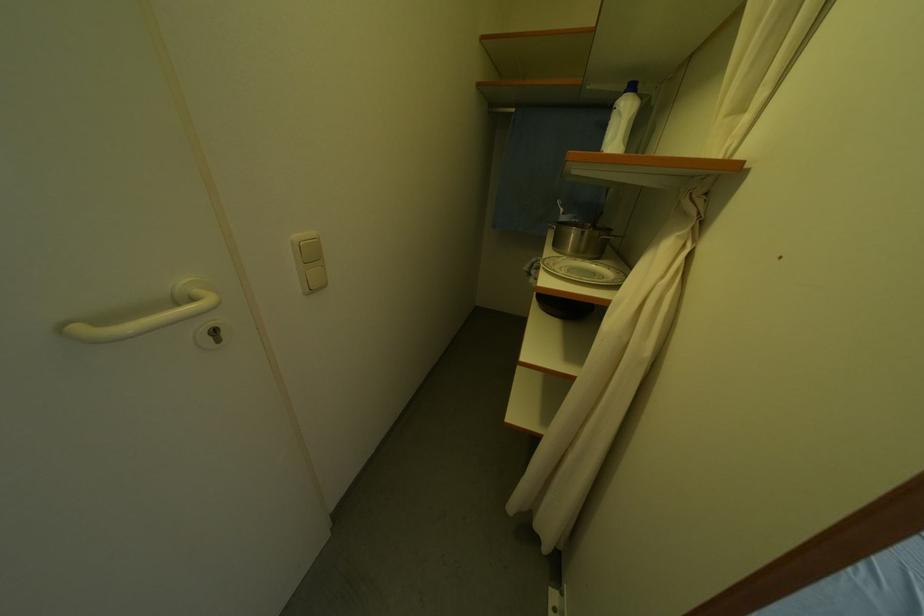
This screenshot has height=616, width=924. What do you see at coordinates (151, 315) in the screenshot?
I see `the white door handle` at bounding box center [151, 315].